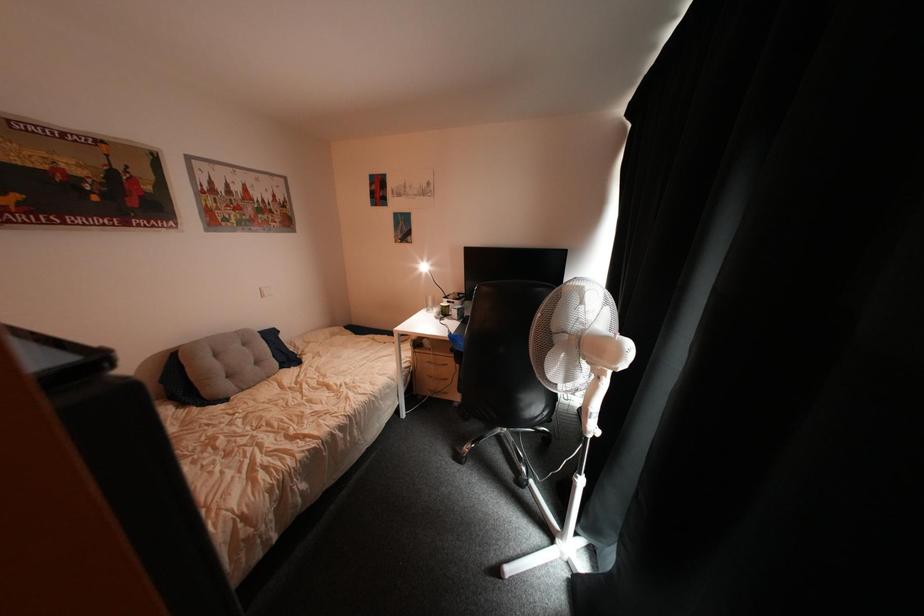
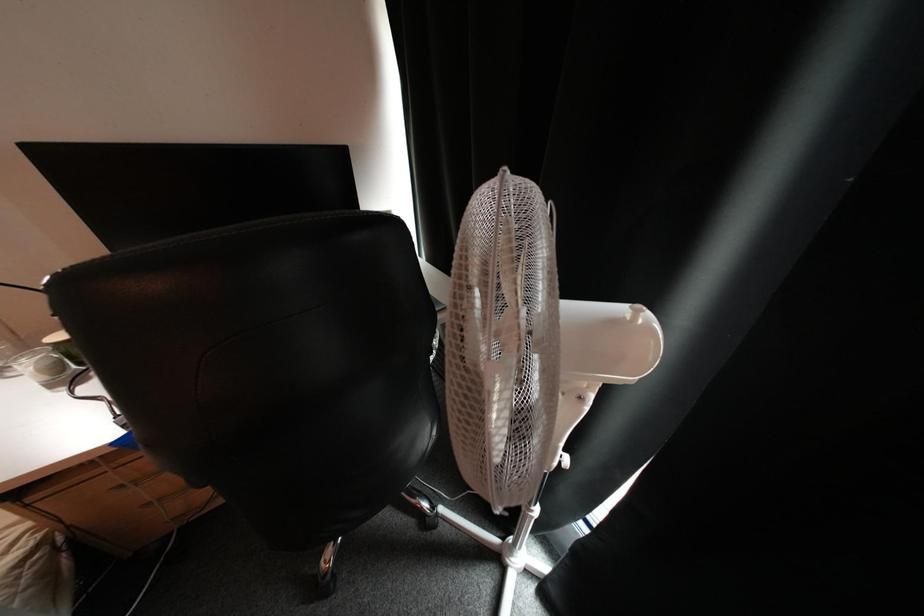
How did the camera likely rotate?

The rotation direction of the camera is right-down.